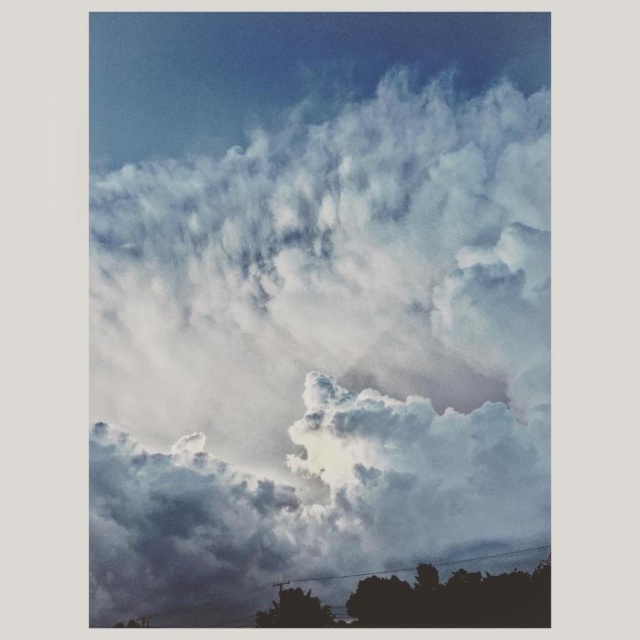
Question: Estimate the real-world distances between objects in this image. Which object is closer to the silhouette tree at bottom?

Choices:
 (A) silhouette tree at lower center
 (B) white fluffy cloud at center

Answer: (A)

Question: Which object is the closest to the white fluffy cloud at center?

Choices:
 (A) silhouette tree at lower center
 (B) silhouette tree at bottom

Answer: (A)

Question: Is silhouette tree at bottom closer to camera compared to silhouette tree at lower center?

Choices:
 (A) no
 (B) yes

Answer: (B)

Question: Is white fluffy cloud at center bigger than silhouette tree at lower center?

Choices:
 (A) yes
 (B) no

Answer: (A)

Question: Does white fluffy cloud at center have a larger size compared to silhouette tree at lower center?

Choices:
 (A) no
 (B) yes

Answer: (B)

Question: Which is nearer to the white fluffy cloud at center?

Choices:
 (A) silhouette tree at lower center
 (B) silhouette tree at bottom

Answer: (A)